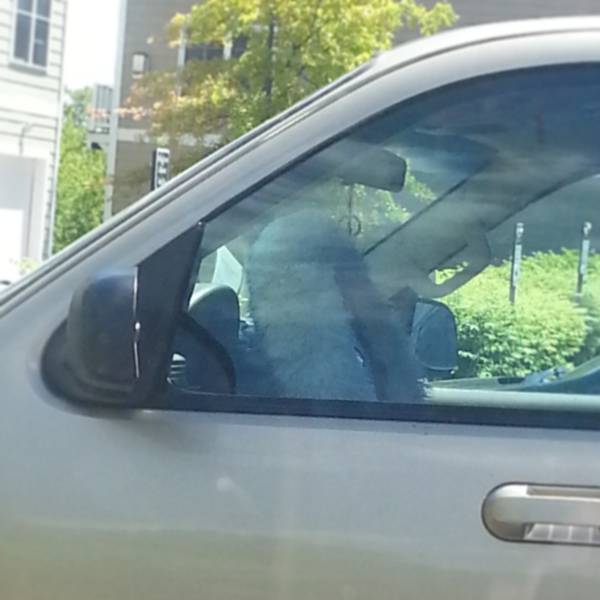
Image resolution: width=600 pixels, height=600 pixels. What are the coordinates of `window` in the screenshot? It's located at (35, 28).